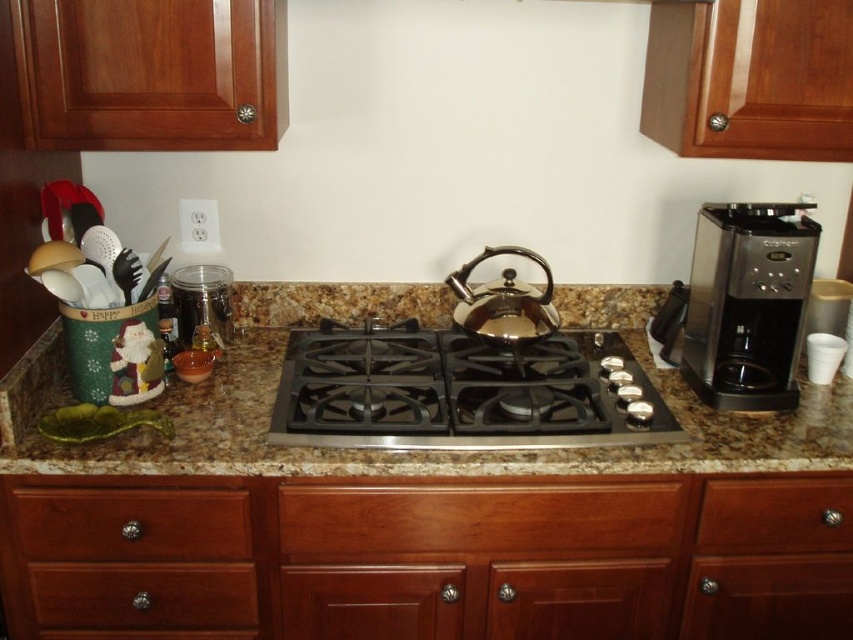
Question: Among these objects, which one is farthest from the camera?

Choices:
 (A) wooden drawer at lower left
 (B) wooden drawer at lower right

Answer: (B)

Question: Among these points, which one is farthest from the camera?

Choices:
 (A) (122, 291)
 (B) (722, 264)
 (C) (595, 536)
 (D) (830, 484)

Answer: (B)

Question: Is marble granite counter top at center to the left of wooden drawer at center from the viewer's perspective?

Choices:
 (A) yes
 (B) no

Answer: (A)

Question: Estimate the real-world distances between objects in this image. Which object is closer to the brown wood drawer at lower left?

Choices:
 (A) black plastic spoon at left
 (B) wooden drawer at lower right

Answer: (A)

Question: Can you confirm if wooden drawer at center is bigger than satin silver coffee maker at right?

Choices:
 (A) no
 (B) yes

Answer: (A)

Question: Can you confirm if wooden drawer at center is bigger than brown wood drawer at lower left?

Choices:
 (A) yes
 (B) no

Answer: (A)